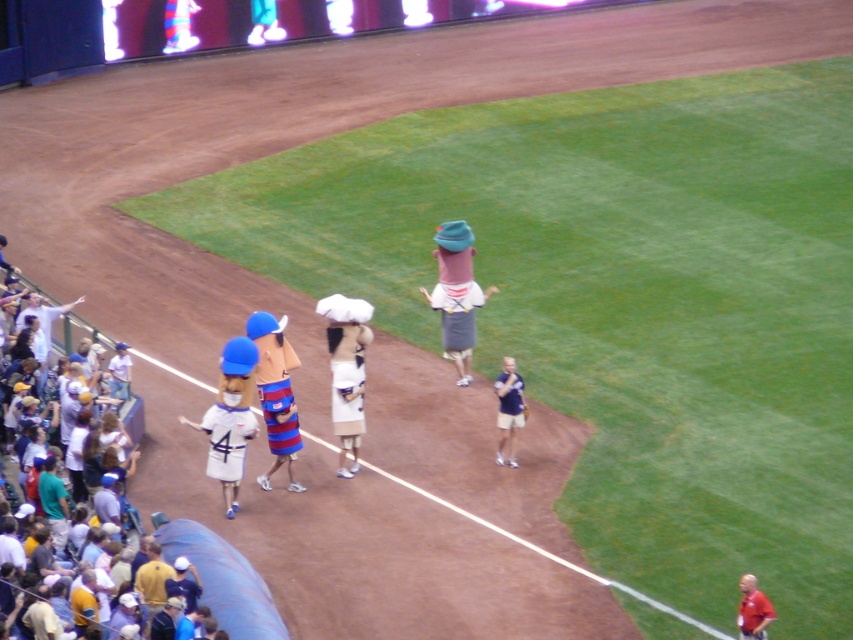
Is point (770, 611) behind point (524, 404)?

No, it is in front of (524, 404).

Which is more to the left, red matte baseball uniform at lower right or dark blue leather glove at center?

dark blue leather glove at center

Between point (741, 620) and point (521, 406), which one is positioned behind?

Positioned behind is point (521, 406).

Locate an element on the screen. red matte baseball uniform at lower right is located at coordinates (753, 611).

Is white matte baseball at center thinner than dark blue leather glove at center?

No, white matte baseball at center is not thinner than dark blue leather glove at center.

Does white matte baseball at center appear on the right side of dark blue leather glove at center?

Incorrect, white matte baseball at center is not on the right side of dark blue leather glove at center.

Find the location of a particular element. Image resolution: width=853 pixels, height=640 pixels. white matte baseball at center is located at coordinates (346, 371).

In order to click on white matte baseball at center in this screenshot , I will do `click(346, 371)`.

Between point (338, 324) and point (747, 608), which one is positioned in front?

Point (747, 608) is more forward.

Can you confirm if white matte baseball at center is positioned to the right of red matte baseball uniform at lower right?

In fact, white matte baseball at center is to the left of red matte baseball uniform at lower right.

You are a GUI agent. You are given a task and a screenshot of the screen. Output one action in this format:
    pyautogui.click(x=<x>, y=<y>)
    Task: Click on the white matte baseball at center
    This screenshot has width=853, height=640.
    Given the screenshot: What is the action you would take?
    pyautogui.click(x=346, y=371)